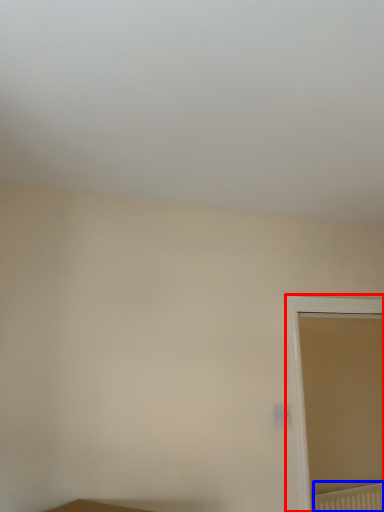
Question: Which object appears closest to the camera in this image, window (highlighted by a red box) or radiator (highlighted by a blue box)?

Choices:
 (A) window
 (B) radiator

Answer: (A)